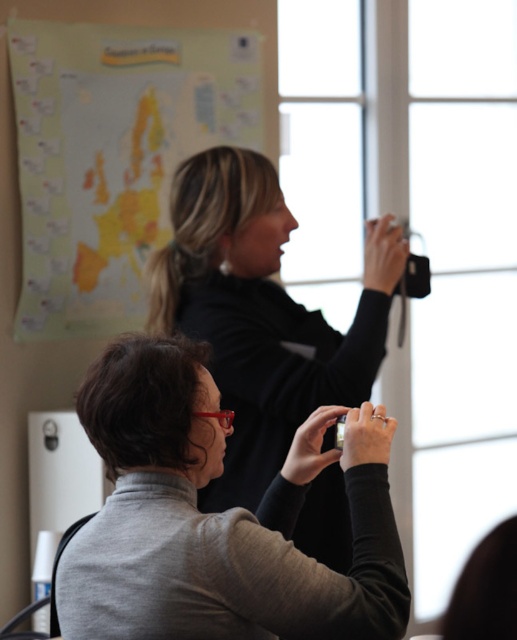
You are an attendee at the presentation. You need to determine which of the two points, point (162,90) or point (285,422), is closer to you. Which one is closer?

Point (162,90) is closer to you because it is further to the viewer than point (285,422).

You are an observer in the room. You see the gray matte turtleneck at lower left and the yellow matte map at upper left. Which object is larger in size?

The gray matte turtleneck at lower left is smaller than the yellow matte map at upper left, so the yellow matte map at upper left is larger in size.

You are a photographer trying to decide where to place a new tripod in the scene. The tripod has a base that requires at least 30 cm of space. Given the gray matte turtleneck at lower left and the black matte camera at upper center, which object is narrower and can accommodate the tripod next to it?

The gray matte turtleneck at lower left is thinner than the black matte camera at upper center, so the tripod can be placed next to the gray matte turtleneck at lower left as it requires less space.